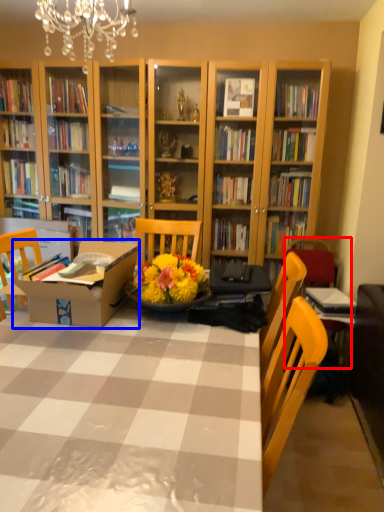
Question: Which object is closer to the camera taking this photo, armchair (highlighted by a red box) or cardboard box (highlighted by a blue box)?

Choices:
 (A) armchair
 (B) cardboard box

Answer: (B)